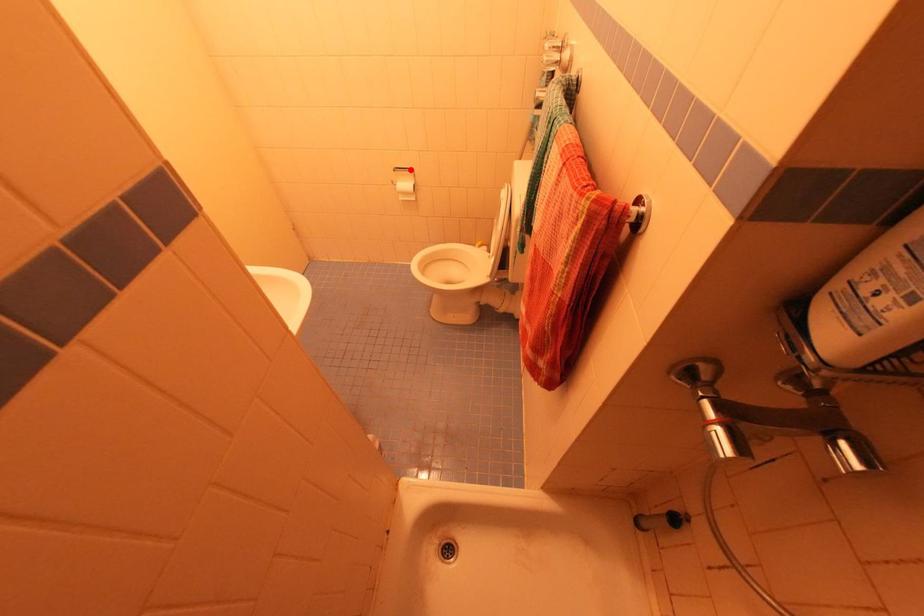
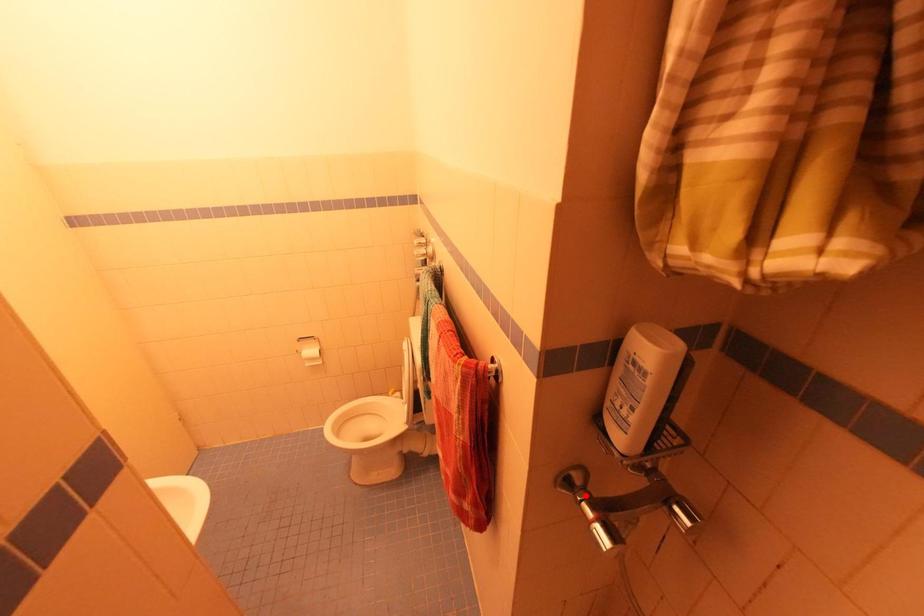
I am providing you with two images of the same scene from different viewpoints. A red point is marked on the first image and another point is marked on the second image. Is the marked point in image1 the same physical position as the marked point in image2?

No